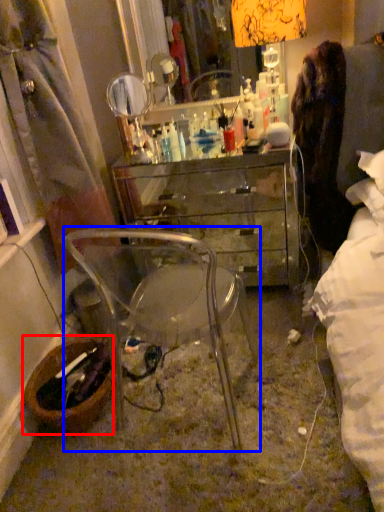
Question: Which object is further to the camera taking this photo, picnic basket (highlighted by a red box) or chair (highlighted by a blue box)?

Choices:
 (A) picnic basket
 (B) chair

Answer: (A)